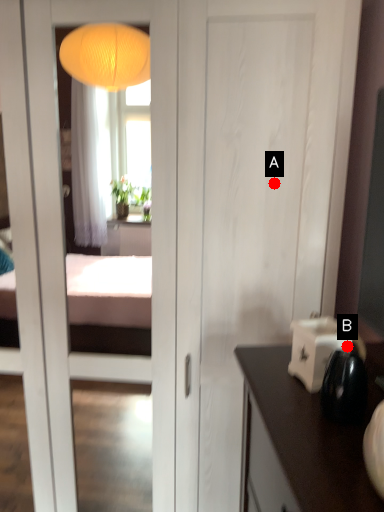
Question: Two points are circled on the image, labeled by A and B beside each circle. Which point appears closest to the camera in this image?

Choices:
 (A) A is closer
 (B) B is closer

Answer: (B)